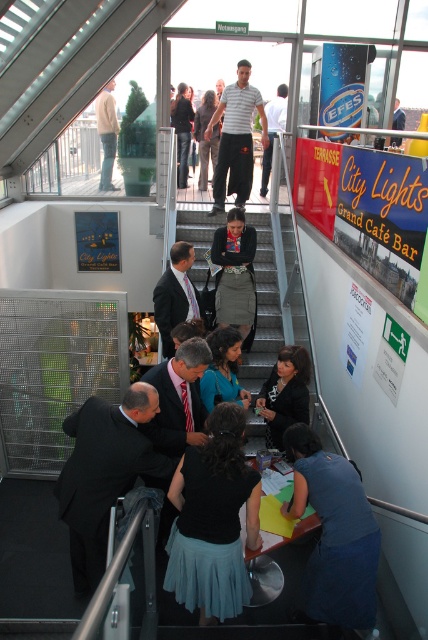
Can you confirm if striped cotton shirt at upper center is shorter than light brown leather jacket at upper center?

No.

Can you confirm if striped cotton shirt at upper center is taller than light brown leather jacket at upper center?

Indeed, striped cotton shirt at upper center has a greater height compared to light brown leather jacket at upper center.

At what (x,y) coordinates should I click in order to perform the action: click on striped cotton shirt at upper center. Please return your answer as a coordinate pair (x, y). Looking at the image, I should click on (235, 138).

Which is in front, point (202, 468) or point (98, 122)?

Point (202, 468) is more forward.

Between black matte skirt at center and light brown leather jacket at upper center, which one is positioned lower?

black matte skirt at center is lower down.

Locate an element on the screen. black matte skirt at center is located at coordinates coord(214,520).

Looking at this image, which is above, black matte skirt at center or blue fabric skirt at lower right?

blue fabric skirt at lower right is above.

Where is `black matte skirt at center`? The image size is (428, 640). black matte skirt at center is located at coordinates (214, 520).